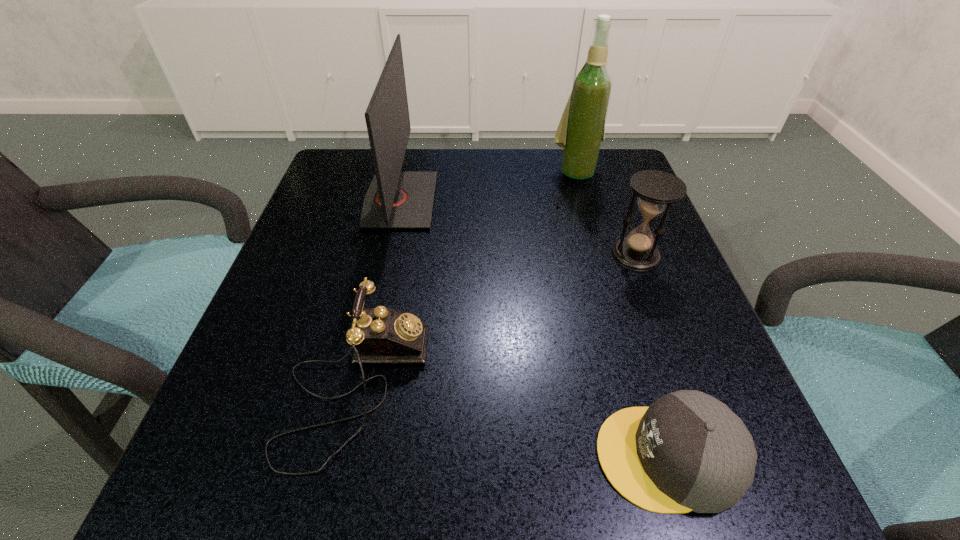
I want to click on wine bottle, so click(581, 130).

This screenshot has height=540, width=960. Identify the location of monitor. (396, 199).

Where is `hourglass`? The width and height of the screenshot is (960, 540). hourglass is located at coordinates (656, 190).

Find the location of a particular element. The height and width of the screenshot is (540, 960). the fourth tallest object is located at coordinates (380, 335).

I want to click on the shortest object, so click(x=687, y=451).

What are the coordinates of `free space located on the front-facing side of the wine bottle` in the screenshot? It's located at (589, 220).

Locate an element on the screen. vacant region located on the screen side of the monitor is located at coordinates (535, 200).

You are a GUI agent. You are given a task and a screenshot of the screen. Output one action in this format:
    pyautogui.click(x=<x>, y=<y>)
    Task: Click on the vacant region located on the front of the hourglass
    The width and height of the screenshot is (960, 540).
    Given the screenshot: What is the action you would take?
    pyautogui.click(x=697, y=420)

Identify the location of vacant region located on the dial of the second shortest object. (687, 387).

Locate an element on the screen. The image size is (960, 540). free space located 0.240m on the front-facing side of the cap is located at coordinates (410, 456).